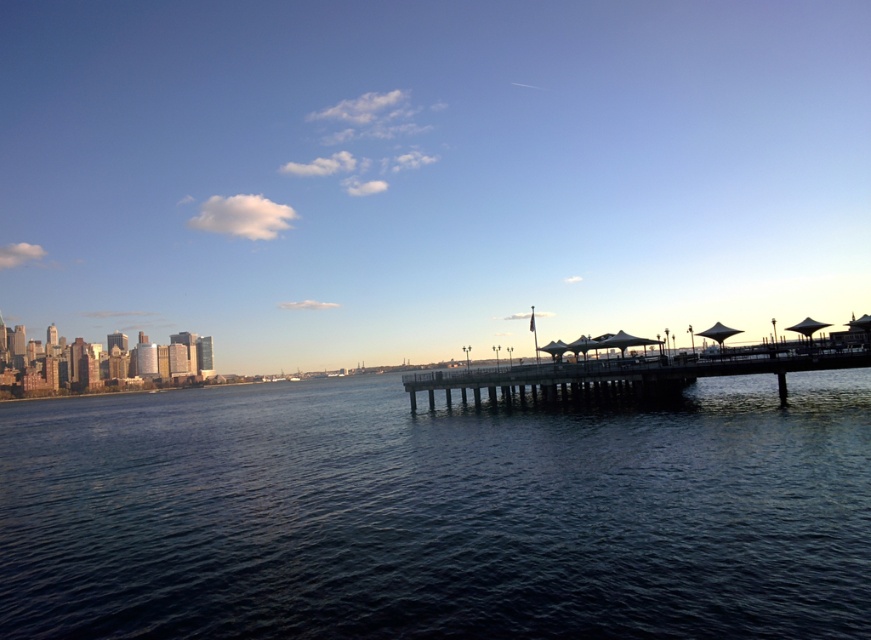
Question: Is wooden pier at center above transparent fabric umbrella at center?

Choices:
 (A) no
 (B) yes

Answer: (A)

Question: Does dark blue water at center appear on the right side of white matte umbrella at center?

Choices:
 (A) no
 (B) yes

Answer: (A)

Question: Among these points, which one is nearest to the camera?

Choices:
 (A) (653, 340)
 (B) (633, 380)
 (C) (583, 353)
 (D) (713, 332)

Answer: (B)

Question: Among these points, which one is nearest to the camera?

Choices:
 (A) (774, 417)
 (B) (619, 332)
 (C) (517, 378)

Answer: (A)

Question: Can you confirm if wooden pier at center is wider than transparent fabric umbrella at center?

Choices:
 (A) no
 (B) yes

Answer: (B)

Question: Which point is closer to the camera taking this photo?

Choices:
 (A) (714, 324)
 (B) (656, 340)
 (C) (595, 348)

Answer: (A)